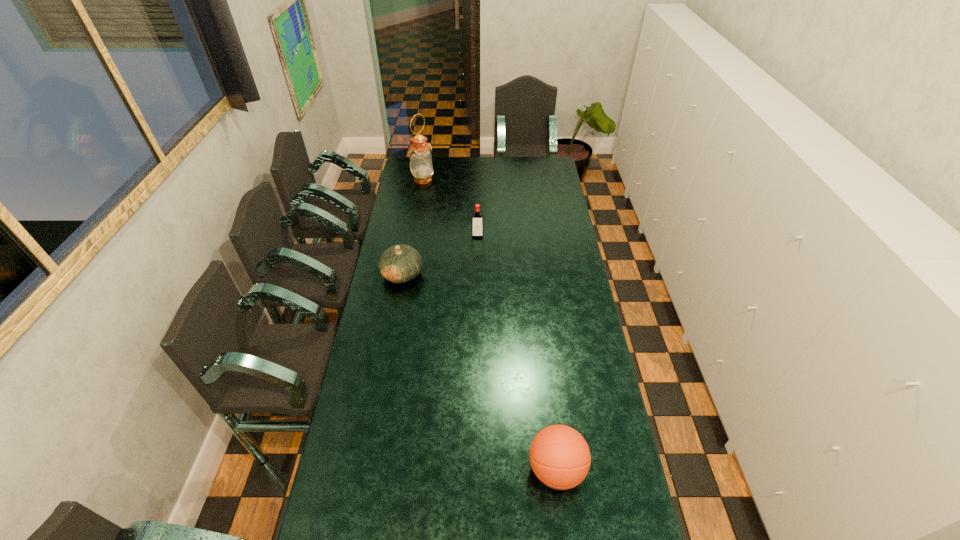
This screenshot has width=960, height=540. What are the coordinates of `object that stands as the third closest to the rightmost object` in the screenshot? It's located at (421, 166).

The image size is (960, 540). Identify the location of object that is the nearest to the gourd. (477, 227).

This screenshot has height=540, width=960. What are the coordinates of `vacant area that satisfies the following two spatial constraints: 1. on the front side of the second nearest object; 2. on the right side of the basketball` in the screenshot? It's located at (368, 469).